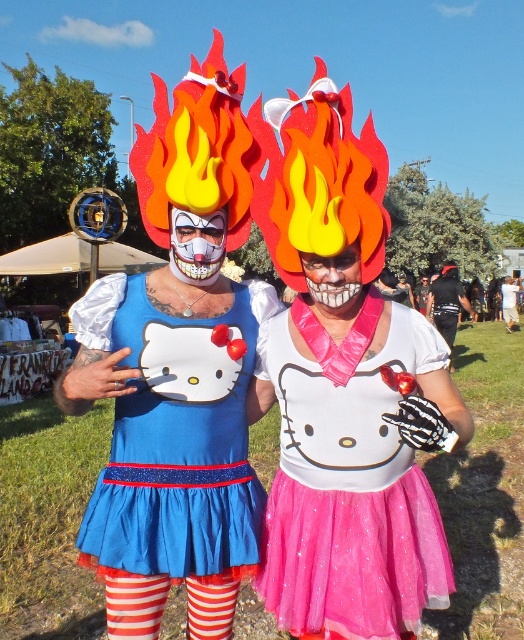
Question: Which object appears farthest from the camera in this image?

Choices:
 (A) pink glittery tutu at center
 (B) blue satin hello kitty dress at center
 (C) white matte skull at center
 (D) shiny black helmet at center

Answer: (D)

Question: From the image, what is the correct spatial relationship of blue satin hello kitty dress at center in relation to matte clown mask at center?

Choices:
 (A) right
 (B) left

Answer: (B)

Question: Among these objects, which one is nearest to the camera?

Choices:
 (A) shiny black helmet at center
 (B) white matte skull at center
 (C) pink glittery tutu at center
 (D) matte clown mask at center

Answer: (C)

Question: Does blue satin hello kitty dress at center have a larger size compared to shiny black helmet at center?

Choices:
 (A) no
 (B) yes

Answer: (B)

Question: Which object is the farthest from the shiny black helmet at center?

Choices:
 (A) pink glittery tutu at center
 (B) black leather jacket at center
 (C) blue satin hello kitty dress at center

Answer: (C)

Question: Can you confirm if white matte skull at center is wider than black leather jacket at center?

Choices:
 (A) no
 (B) yes

Answer: (A)